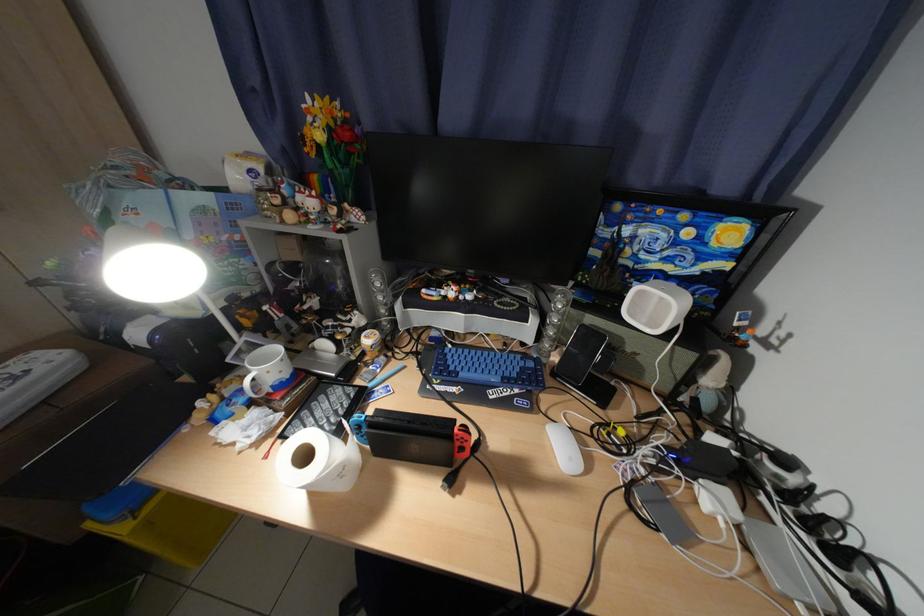
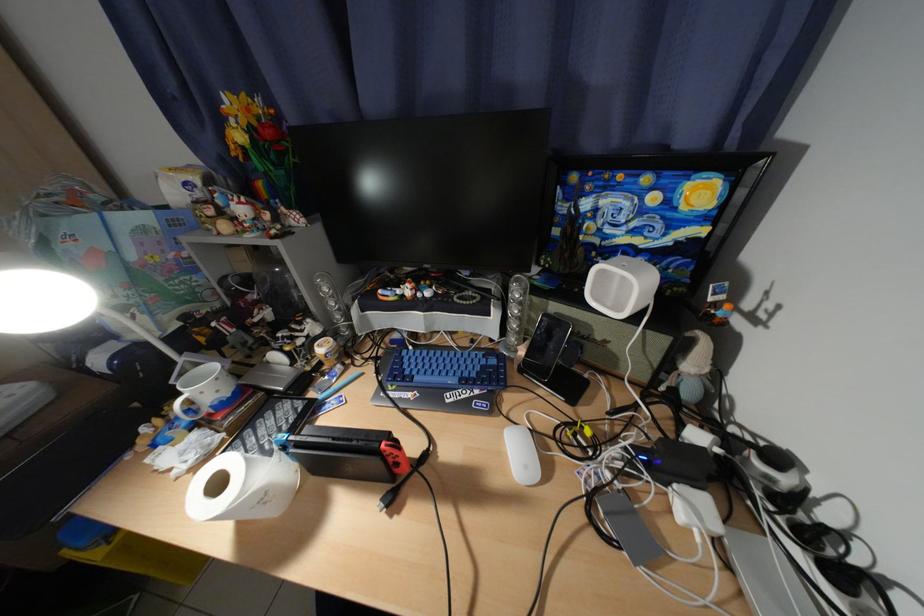
The point at (724, 500) is marked in the first image. Where is the corresponding point in the second image?

(700, 508)